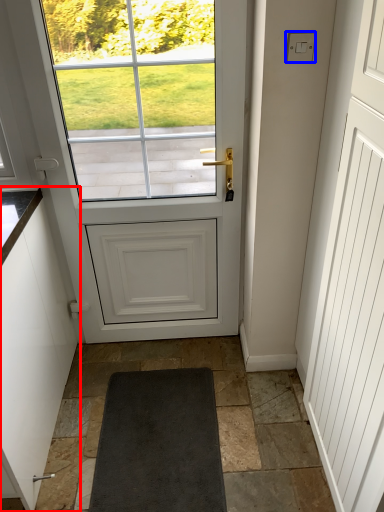
Question: Which point is further to the camera, cabinetry (highlighted by a red box) or lock (highlighted by a blue box)?

Choices:
 (A) cabinetry
 (B) lock

Answer: (B)